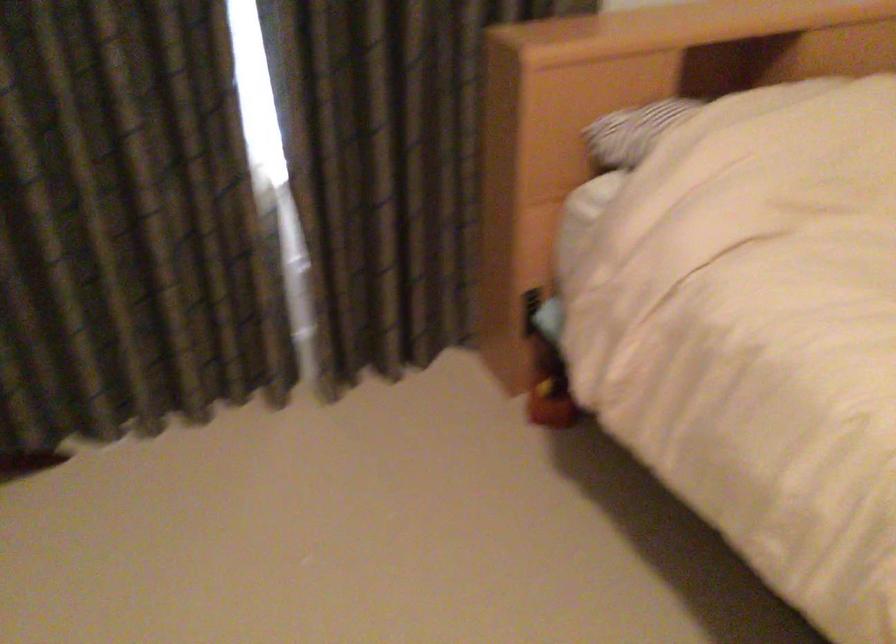
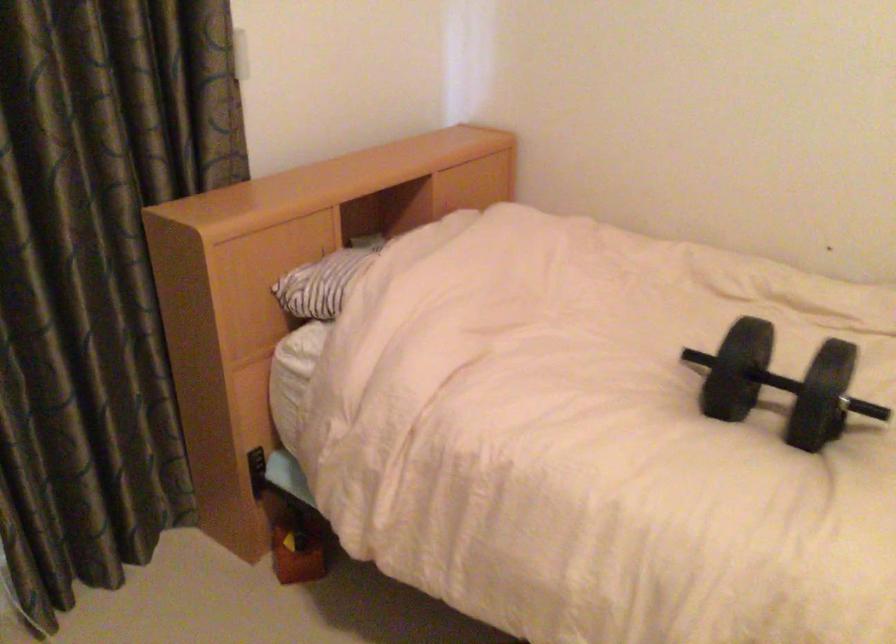
Question: The images are taken continuously from a first-person perspective. In which direction is your viewpoint rotating?

Choices:
 (A) Left
 (B) Right
 (C) Up
 (D) Down

Answer: (B)